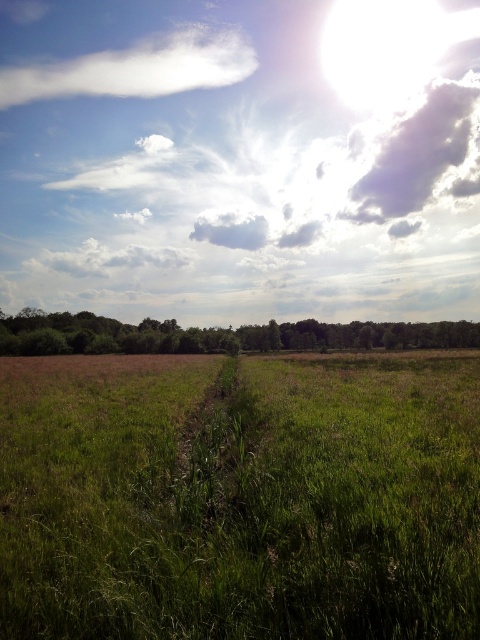
What do you see at coordinates (240, 497) in the screenshot? The width and height of the screenshot is (480, 640). I see `green grassy at center` at bounding box center [240, 497].

Does green grassy at center have a larger size compared to gray fluffy cloud at upper center?

No.

Identify the location of green grassy at center. click(x=240, y=497).

How far apart are green leafy trees at center and white fluffy cloud at upper right?

They are 88.77 meters apart.

Is green leafy trees at center thinner than white fluffy cloud at upper right?

In fact, green leafy trees at center might be wider than white fluffy cloud at upper right.

Where is `green leafy trees at center`? The height and width of the screenshot is (640, 480). green leafy trees at center is located at coordinates (216, 336).

Between bright white cloud at upper center and green grassy at center, which one has more height?

Standing taller between the two is bright white cloud at upper center.

What do you see at coordinates (240, 157) in the screenshot? I see `bright white cloud at upper center` at bounding box center [240, 157].

What are the coordinates of `bright white cloud at upper center` in the screenshot? It's located at (240, 157).